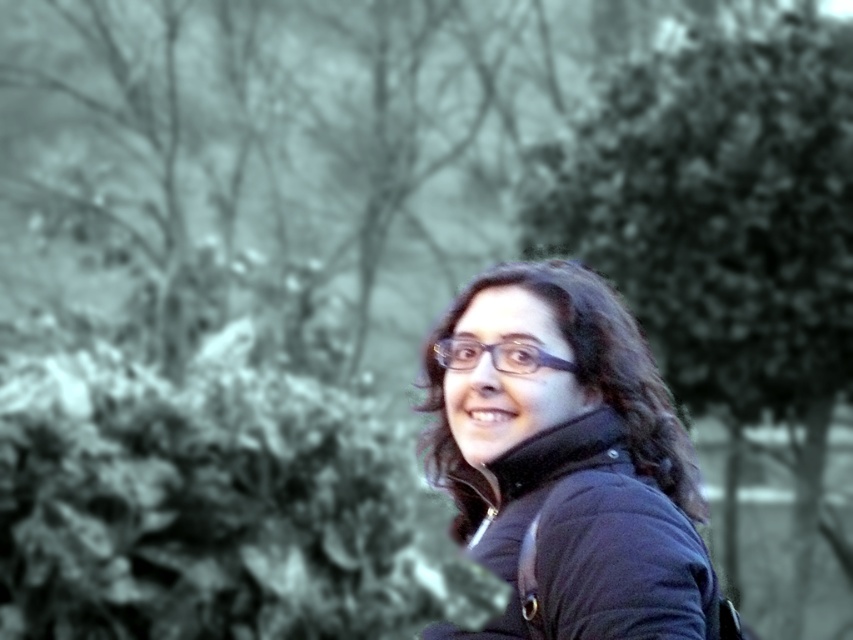
Is green leafy tree at right positioned before matte black jacket at center?

No, green leafy tree at right is further to the viewer.

Between point (849, 392) and point (675, 531), which one is positioned behind?

The point (849, 392) is behind.

Which is in front, point (657, 83) or point (677, 445)?

Positioned in front is point (677, 445).

This screenshot has height=640, width=853. Find the location of `green leafy tree at right`. green leafy tree at right is located at coordinates (724, 230).